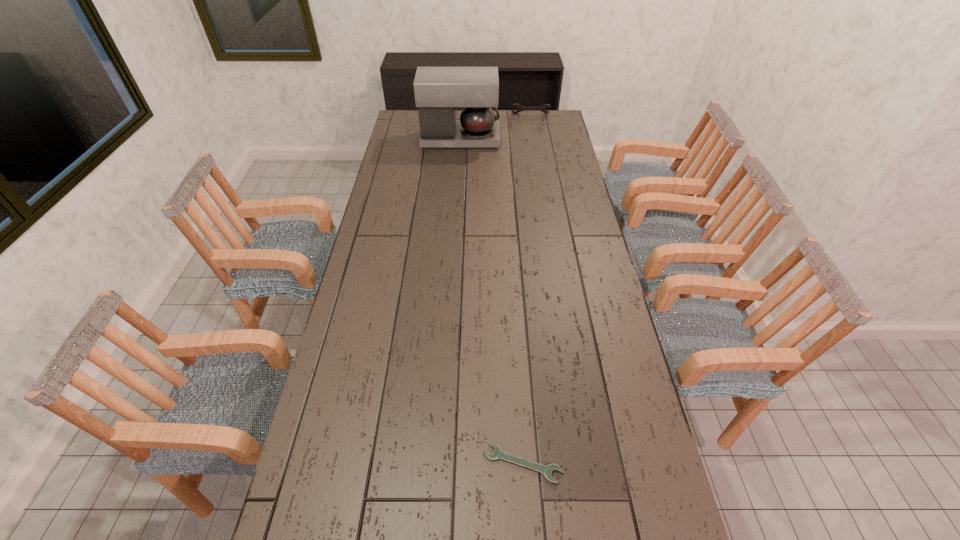
Locate an element on the screen. The height and width of the screenshot is (540, 960). wrench that is positioned at the far edge is located at coordinates (520, 108).

Image resolution: width=960 pixels, height=540 pixels. Identify the location of object positioned at the left edge. (438, 91).

Locate an element on the screen. object that is positioned at the right edge is located at coordinates (520, 108).

Identify the location of object located at the far left corner. (438, 91).

You are a GUI agent. You are given a task and a screenshot of the screen. Output one action in this format:
    pyautogui.click(x=<x>, y=<y>)
    Task: Click on the object that is at the far right corner
    The height and width of the screenshot is (540, 960).
    Given the screenshot: What is the action you would take?
    pyautogui.click(x=520, y=108)

Find the location of `free space at the left edge of the desktop`. free space at the left edge of the desktop is located at coordinates (384, 282).

Image resolution: width=960 pixels, height=540 pixels. I want to click on vacant space at the right edge of the desktop, so click(573, 178).

The image size is (960, 540). Identify the location of vacant region at the far left corner of the desktop. (402, 130).

This screenshot has height=540, width=960. I want to click on vacant area at the far right corner, so click(x=544, y=121).

At what (x,y) coordinates should I click in order to perform the action: click on free spot between the shortest object and the taller wrench. Please return your answer as a coordinate pair (x, y). The image size is (960, 540). Looking at the image, I should click on (527, 289).